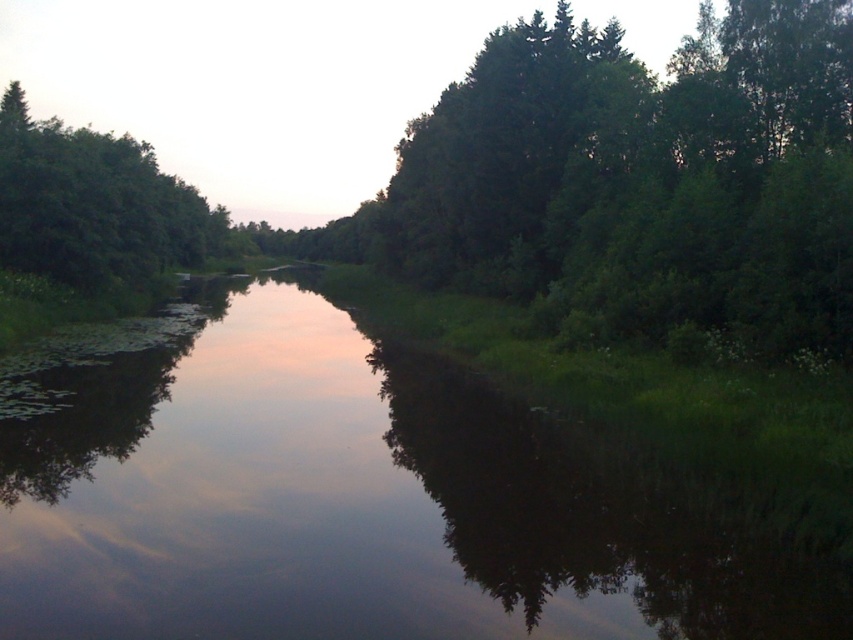
You are standing at the edge of the green grassy stream at center and want to see the top of the green leafy tree at left. Considering their heights, can you see the tree top without moving your position?

The green grassy stream at center has a lesser height compared to green leafy tree at left, so yes, you can see the top of the green leafy tree at left from your current position because the stream is shorter and won

You are standing at the point with coordinates point (102, 150) and want to reach the point with coordinates point (392, 595). Which direction should you move to get closer to your destination?

You should move forward because point (392, 595) is in front of point (102, 150).

Consider the image. You are standing at the camera position and want to cross the river using a small wooden bridge that is 5 meters long. Is the bridge long enough to reach the green grassy stream at center?

The distance between the camera and the green grassy stream at center is 6.44 meters. Since the bridge is only 5 meters long, it is not long enough to reach the stream.